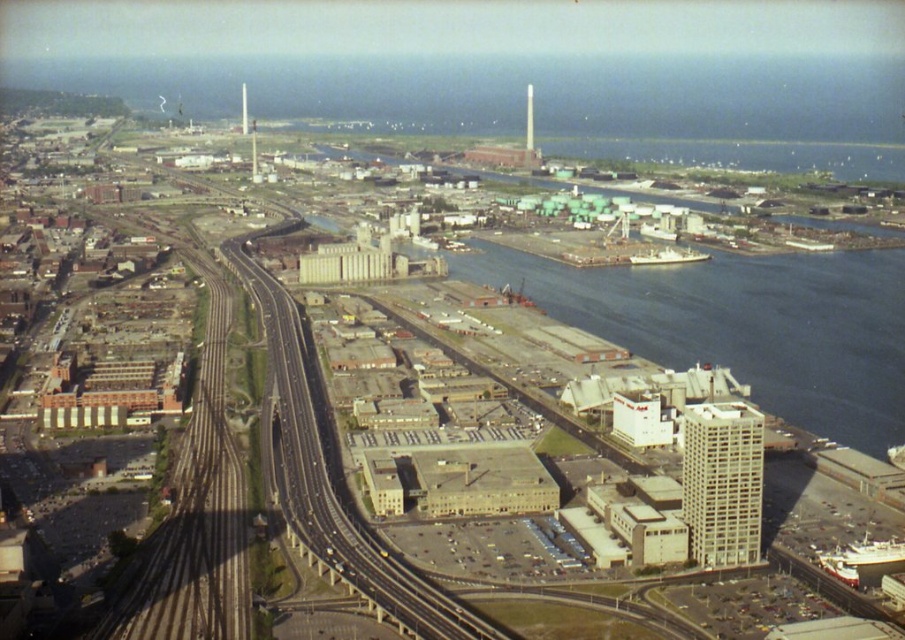
What do you see at coordinates (745, 324) in the screenshot? The height and width of the screenshot is (640, 905). I see `blue water at center` at bounding box center [745, 324].

Who is more distant from viewer, (756,284) or (493,636)?

Point (756,284)

Where is `blue water at center`? The image size is (905, 640). blue water at center is located at coordinates click(745, 324).